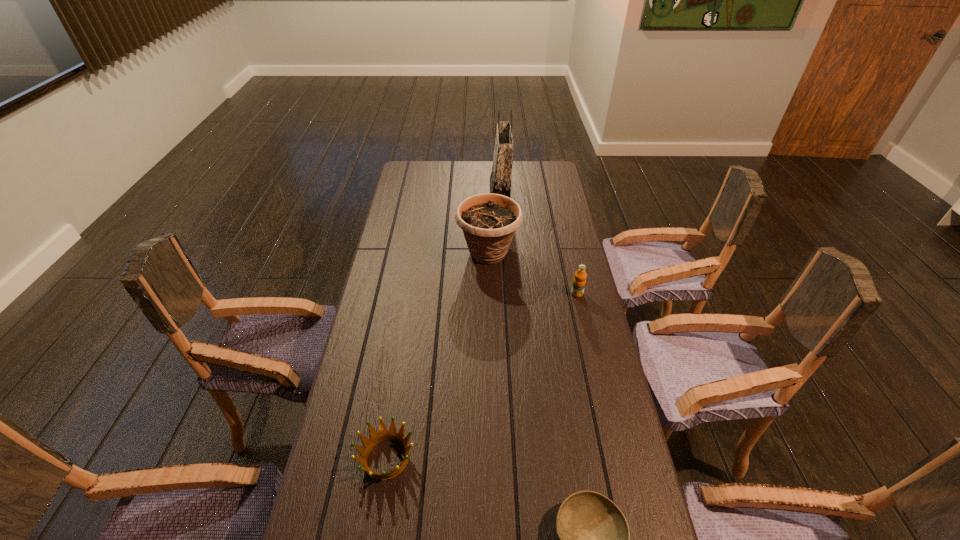
Locate an element on the screen. Image resolution: width=960 pixels, height=540 pixels. free space between the leftmost object and the orange juice is located at coordinates (482, 376).

Identify the location of free area in between the flowerpot and the second shortest object. (438, 355).

At what (x,y) coordinates should I click in order to perform the action: click on vacant point located between the second nearest object and the tallest object. Please return your answer as a coordinate pair (x, y). Looking at the image, I should click on (444, 325).

Where is `vacant space in between the fourth farthest object and the tallest object`? The height and width of the screenshot is (540, 960). vacant space in between the fourth farthest object and the tallest object is located at coordinates (444, 325).

Image resolution: width=960 pixels, height=540 pixels. Identify the location of object that is the third closest one to the orange juice. (593, 534).

This screenshot has height=540, width=960. In order to click on object that is the fourth nearest to the nearest object in this screenshot , I will do (x=500, y=179).

This screenshot has width=960, height=540. What are the coordinates of `free space that satisfies the following two spatial constraints: 1. on the front of the tallest object with the design; 2. on the front side of the fourth nearest object` in the screenshot? It's located at (504, 253).